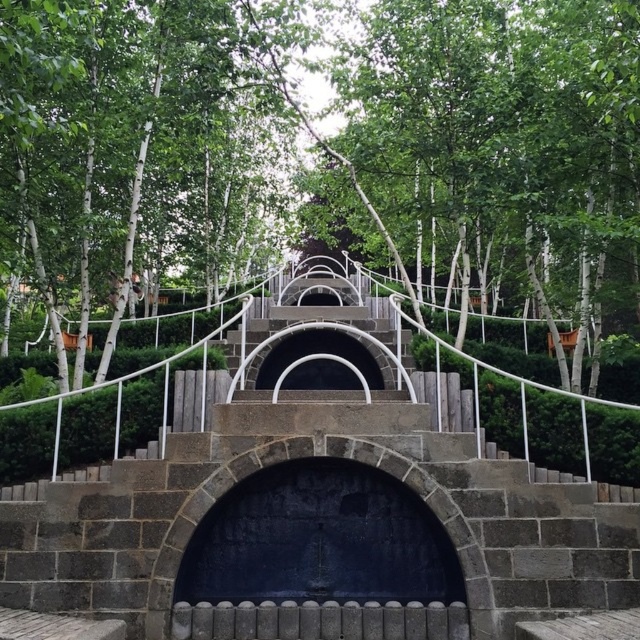
You are standing in front of the multi tiered stone structure and notice the green leafy tree at center and the black stone arch at center. Which object is closer to you?

The green leafy tree at center is closer to you because the black stone arch at center is behind it.

You are planning to take a photo of the green leafy tree at center and the black stone arch at center. Which object will have a smaller footprint in your photo?

The green leafy tree at center occupies less space than the black stone arch at center, so it will have a smaller footprint in the photo.

You are standing at the base of the stone structure and want to reach the higher level. There are two points marked on the structure, point 1 at coordinates point (570, 259) and point 2 at coordinates point (339, 609). Which point is closer to you as you look up the structure?

Point 1 at coordinates point (570, 259) is closer to you because it is further to the viewer than point 2 at coordinates point (339, 609).